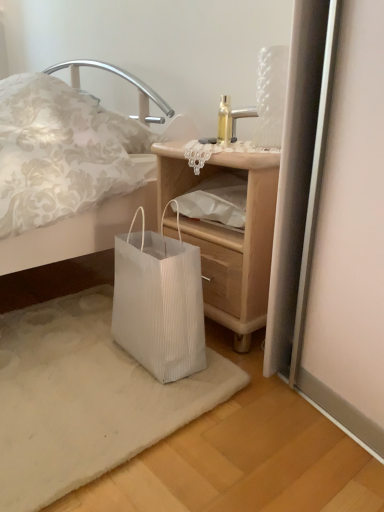
Question: In terms of height, does white paper bag at lower left look taller or shorter compared to wooden nightstand at lower center?

Choices:
 (A) tall
 (B) short

Answer: (B)

Question: Considering the positions of white paper bag at lower left and wooden nightstand at lower center in the image, is white paper bag at lower left wider or thinner than wooden nightstand at lower center?

Choices:
 (A) thin
 (B) wide

Answer: (A)

Question: Estimate the real-world distances between objects in this image. Which object is farther from the white pleated paper bag at lower left?

Choices:
 (A) wooden nightstand at lower center
 (B) white paper bag at lower left

Answer: (A)

Question: Which is farther from the wooden nightstand at lower center?

Choices:
 (A) white paper bag at lower left
 (B) white pleated paper bag at lower left

Answer: (B)